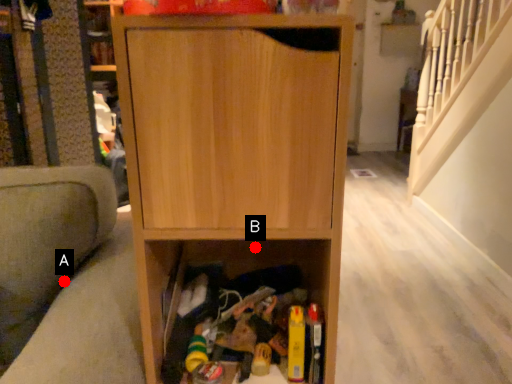
Question: Two points are circled on the image, labeled by A and B beside each circle. Among these points, which one is farthest from the camera?

Choices:
 (A) A is further
 (B) B is further

Answer: (A)